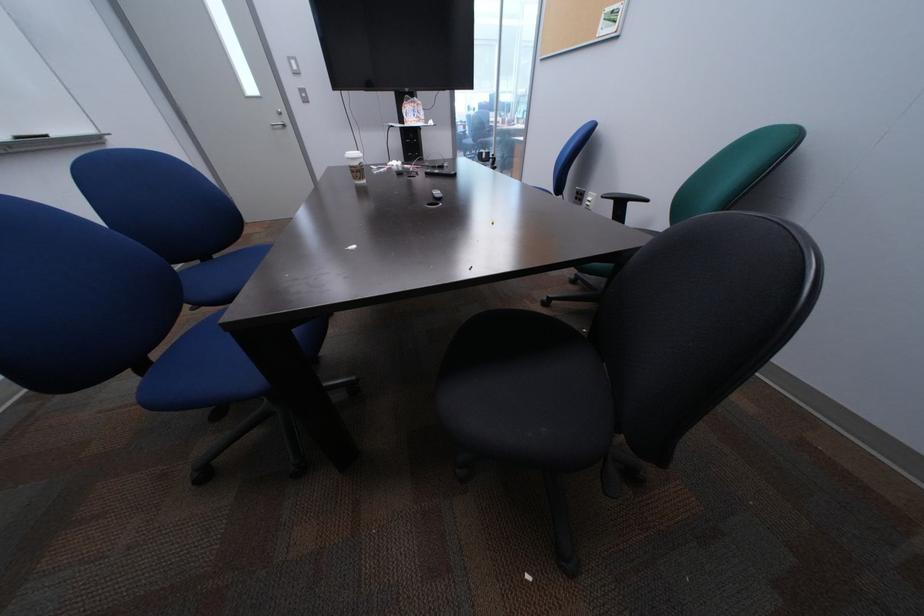
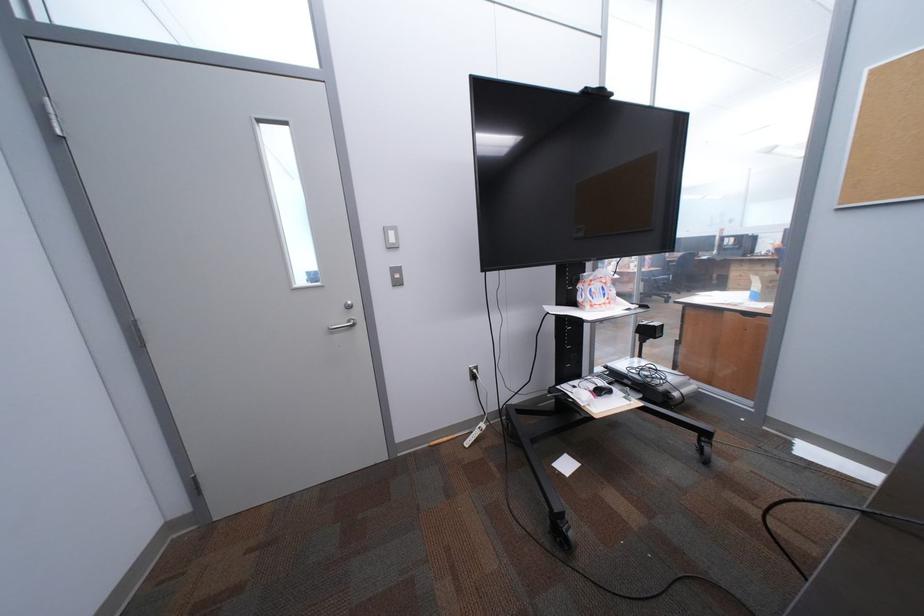
Which direction would the cameraman need to move to produce the second image?

The cameraman walked toward left, forward.